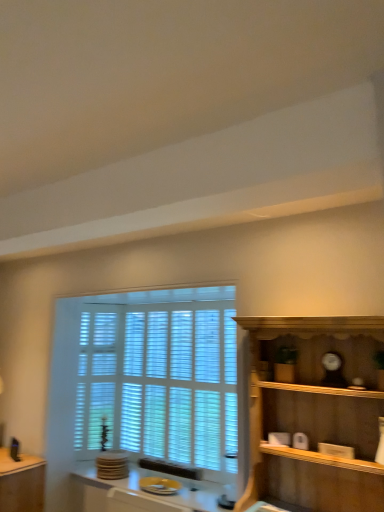
Question: Can you confirm if white wood window at center is thinner than wooden shelf at right?

Choices:
 (A) yes
 (B) no

Answer: (A)

Question: Can you confirm if white wood window at center is positioned to the left of wooden shelf at right?

Choices:
 (A) yes
 (B) no

Answer: (A)

Question: From a real-world perspective, is white wood window at center below wooden shelf at right?

Choices:
 (A) no
 (B) yes

Answer: (B)

Question: Considering the relative sizes of white wood window at center and wooden shelf at right in the image provided, is white wood window at center shorter than wooden shelf at right?

Choices:
 (A) no
 (B) yes

Answer: (A)

Question: Considering the relative sizes of white wood window at center and wooden shelf at right in the image provided, is white wood window at center bigger than wooden shelf at right?

Choices:
 (A) yes
 (B) no

Answer: (B)

Question: From the image's perspective, relative to matte brown table at lower left, is yellow glossy plate at lower center above or below?

Choices:
 (A) below
 (B) above

Answer: (B)

Question: Does point (192, 482) appear closer or farther from the camera than point (18, 468)?

Choices:
 (A) farther
 (B) closer

Answer: (A)

Question: Considering the positions of yellow glossy plate at lower center and matte brown table at lower left in the image, is yellow glossy plate at lower center taller or shorter than matte brown table at lower left?

Choices:
 (A) tall
 (B) short

Answer: (B)

Question: Would you say yellow glossy plate at lower center is to the left or to the right of matte brown table at lower left in the picture?

Choices:
 (A) left
 (B) right

Answer: (B)

Question: Visually, is matte brown table at lower left positioned to the left or to the right of yellow glossy plate at lower center?

Choices:
 (A) left
 (B) right

Answer: (A)

Question: From a real-world perspective, is matte brown table at lower left physically located above or below yellow glossy plate at lower center?

Choices:
 (A) above
 (B) below

Answer: (B)

Question: Considering the positions of matte brown table at lower left and yellow glossy plate at lower center in the image, is matte brown table at lower left bigger or smaller than yellow glossy plate at lower center?

Choices:
 (A) small
 (B) big

Answer: (B)

Question: Is matte brown table at lower left wider or thinner than yellow glossy plate at lower center?

Choices:
 (A) thin
 (B) wide

Answer: (A)

Question: Based on their positions, is wooden shelf at right located to the left or right of yellow glossy plate at lower center?

Choices:
 (A) right
 (B) left

Answer: (A)

Question: Considering the positions of wooden shelf at right and yellow glossy plate at lower center in the image, is wooden shelf at right taller or shorter than yellow glossy plate at lower center?

Choices:
 (A) short
 (B) tall

Answer: (B)